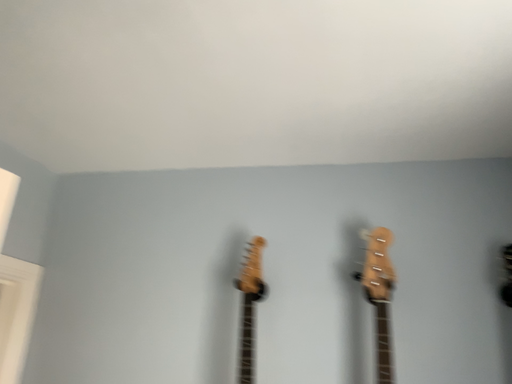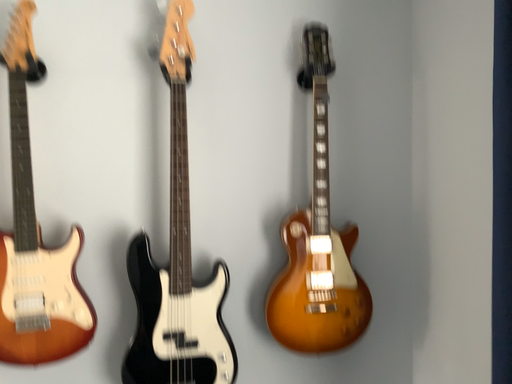
Question: How did the camera likely rotate when shooting the video?

Choices:
 (A) rotated upward
 (B) rotated downward

Answer: (B)